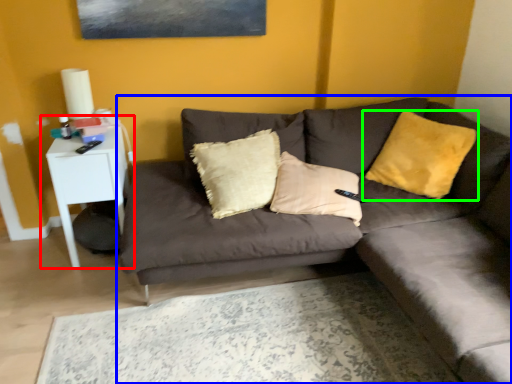
Question: Which object is positioned farthest from table (highlighted by a red box)? Select from studio couch (highlighted by a blue box) and pillow (highlighted by a green box).

Choices:
 (A) studio couch
 (B) pillow

Answer: (B)